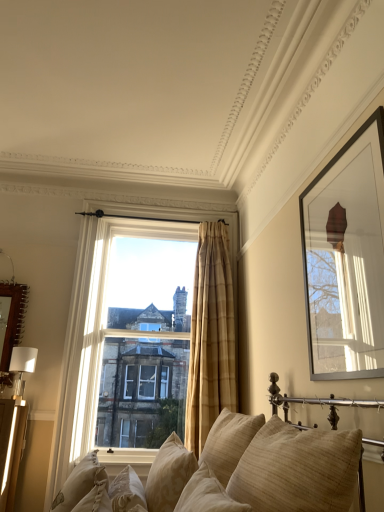
Question: From a real-world perspective, is white glossy table lamp at left on top of matte black picture frame at upper right, marked as the first picture frame in a front-to-back arrangement?

Choices:
 (A) no
 (B) yes

Answer: (A)

Question: Considering the relative sizes of white glossy table lamp at left and matte black picture frame at upper right, the 1th picture frame viewed from the right, in the image provided, is white glossy table lamp at left shorter than matte black picture frame at upper right, the 1th picture frame viewed from the right,?

Choices:
 (A) no
 (B) yes

Answer: (B)

Question: Is white glossy table lamp at left aimed at matte black picture frame at upper right, the 1th picture frame viewed from the right?

Choices:
 (A) yes
 (B) no

Answer: (B)

Question: Considering the relative positions of white glossy table lamp at left and matte black picture frame at upper right, the 1th picture frame viewed from the right, in the image provided, is white glossy table lamp at left to the right of matte black picture frame at upper right, the 1th picture frame viewed from the right, from the viewer's perspective?

Choices:
 (A) no
 (B) yes

Answer: (A)

Question: Is white glossy table lamp at left thinner than matte black picture frame at upper right, the 1th picture frame viewed from the right?

Choices:
 (A) no
 (B) yes

Answer: (A)

Question: Is white glossy table lamp at left bigger than matte black picture frame at upper right, the 1th picture frame viewed from the right?

Choices:
 (A) yes
 (B) no

Answer: (B)

Question: Is beige textured pillow at lower center, which is the 3th pillow from left to right, with beige fabric couch at center?

Choices:
 (A) yes
 (B) no

Answer: (B)

Question: Is beige textured pillow at lower center, acting as the 4th pillow starting from the right, smaller than beige fabric couch at center?

Choices:
 (A) yes
 (B) no

Answer: (A)

Question: Is beige textured pillow at lower center, which is the 3th pillow from left to right, facing towards beige fabric couch at center?

Choices:
 (A) no
 (B) yes

Answer: (B)

Question: Is beige textured pillow at lower center, which is the 3th pillow from left to right, outside of beige fabric couch at center?

Choices:
 (A) yes
 (B) no

Answer: (B)

Question: Can you confirm if beige textured pillow at lower center, which is the 3th pillow from left to right, is wider than beige fabric couch at center?

Choices:
 (A) yes
 (B) no

Answer: (B)

Question: From a real-world perspective, is beige textured pillow at lower center, which is the 3th pillow from left to right, on top of beige fabric couch at center?

Choices:
 (A) yes
 (B) no

Answer: (B)

Question: Does beige textured pillow at lower center, which ranks as the 2th pillow in left-to-right order, lie behind beige textured pillow at lower center, acting as the 4th pillow starting from the right?

Choices:
 (A) no
 (B) yes

Answer: (A)